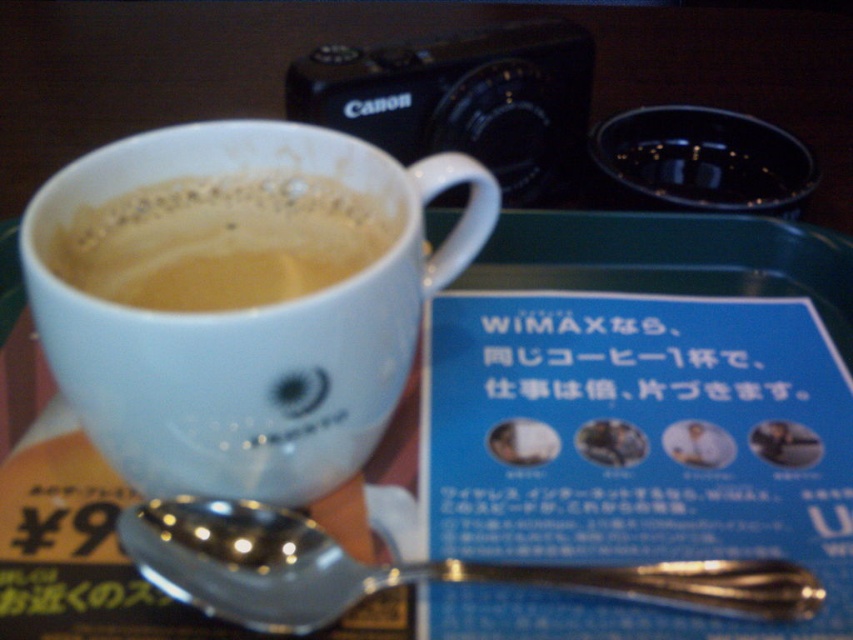
You are trying to determine which object is bigger between the silver metallic spoon at lower left and the white matte cup at upper center. Based on the scene, which one is larger?

The white matte cup at upper center is larger than the silver metallic spoon at lower left.

You are setting up a table for a guest. You have a white glossy mug at upper center and a silver metallic spoon at lower left. Where should you place the spoon relative to the mug to match the scene?

The silver metallic spoon at lower left should be placed to the right of the white glossy mug at upper center, as the white glossy mug at upper center is to the left of the silver metallic spoon at lower left in the scene.